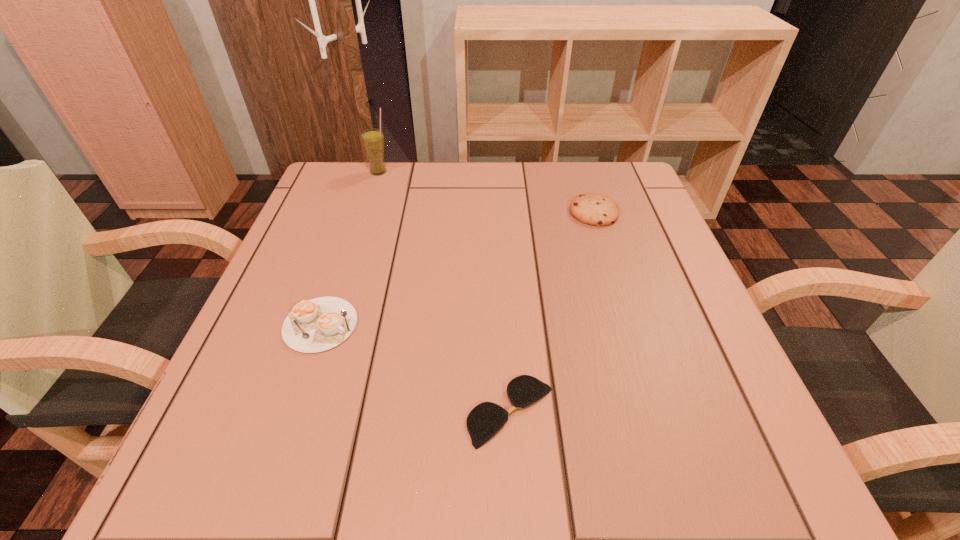
The height and width of the screenshot is (540, 960). I want to click on vacant region that satisfies the following two spatial constraints: 1. on the front side of the spectacles; 2. on the left side of the farthest object, so click(x=303, y=411).

Identify the location of vacant space that satisfies the following two spatial constraints: 1. on the front side of the nearest object; 2. on the left side of the farthest object. The height and width of the screenshot is (540, 960). tap(303, 411).